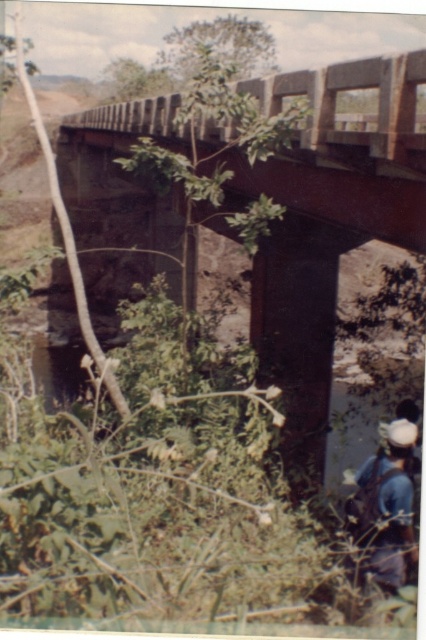
Question: Does rusty metal bridge at upper center appear on the left side of blue denim jeans at lower right?

Choices:
 (A) no
 (B) yes

Answer: (B)

Question: Which point is farther to the camera?

Choices:
 (A) rusty metal bridge at upper center
 (B) blue denim jeans at lower right

Answer: (A)

Question: Where is rusty metal bridge at upper center located in relation to blue denim jeans at lower right in the image?

Choices:
 (A) right
 (B) left

Answer: (B)

Question: Does rusty metal bridge at upper center appear over blue denim jeans at lower right?

Choices:
 (A) yes
 (B) no

Answer: (A)